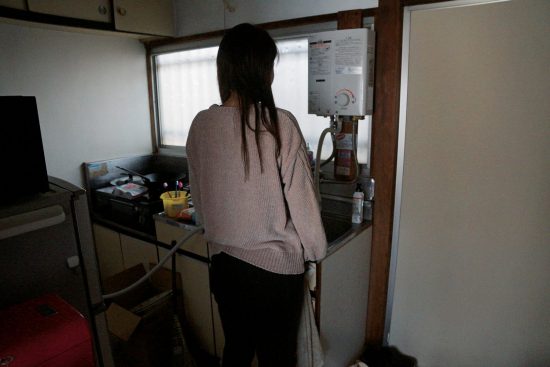
Identify the location of reddish floor. (57, 348).